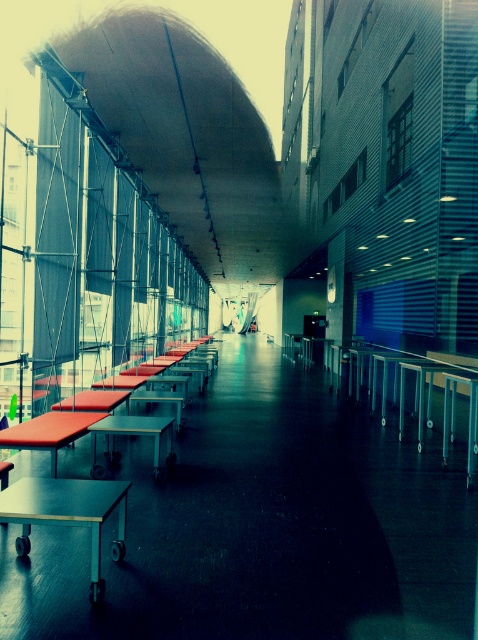
You are standing in a corridor and want to reach the light brown wooden table at lower left. If you are currently 3 meters away from it, can you reach the table in one step?

The light brown wooden table at lower left and viewer are 3.11 meters apart, so no, you cannot reach the table in one step since 3.11 meters is slightly further than 3 meters.

You are standing at the entrance of the corridor and want to reach the point marked as point (21, 545) first before going to point (137, 392). Given that both points are along your path, which direction should you turn immediately after entering to prioritize reaching the closer point first?

Since point (21, 545) is closer to the viewer than point (137, 392), you should go straight ahead immediately after entering the corridor to reach point (21, 545) first before proceeding to the farther point (137, 392).